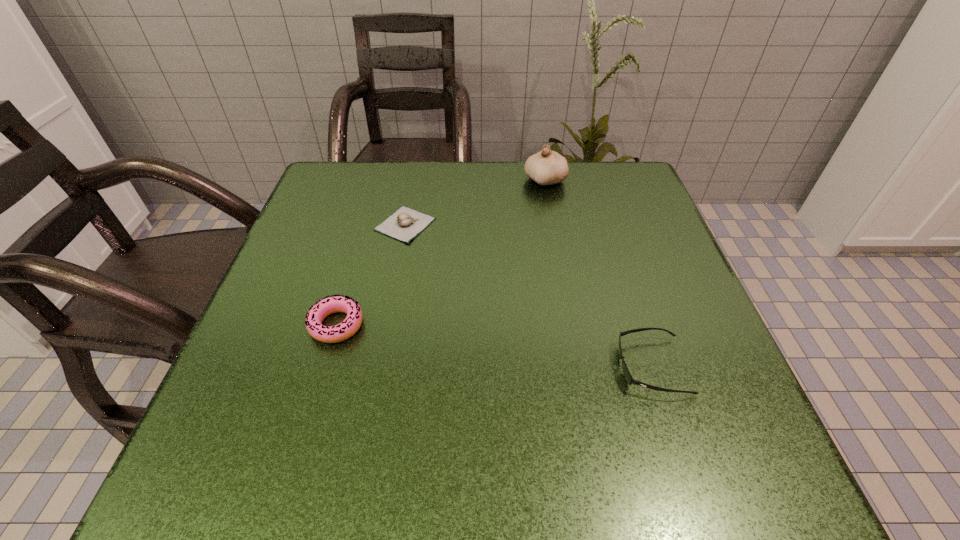
Where is `vacant space situated 0.250m on the front-facing side of the rightmost object`? The image size is (960, 540). vacant space situated 0.250m on the front-facing side of the rightmost object is located at coordinates (466, 366).

Identify the location of vacant area situated 0.120m on the right of the left garlic. This screenshot has width=960, height=540. (490, 224).

At what (x,y) coordinates should I click in order to perform the action: click on object that is positioned at the left edge. Please return your answer as a coordinate pair (x, y). The image size is (960, 540). Looking at the image, I should click on (317, 313).

Locate an element on the screen. The width and height of the screenshot is (960, 540). object that is positioned at the right edge is located at coordinates (627, 375).

Locate an element on the screen. This screenshot has width=960, height=540. free space at the far edge of the desktop is located at coordinates [x=535, y=197].

Where is `vacant space at the left edge`? The image size is (960, 540). vacant space at the left edge is located at coordinates (330, 262).

Where is `vacant region at the right edge of the desktop`? The image size is (960, 540). vacant region at the right edge of the desktop is located at coordinates (638, 267).

The image size is (960, 540). What are the coordinates of `vacant space at the far left corner` in the screenshot? It's located at (330, 174).

Image resolution: width=960 pixels, height=540 pixels. In the image, there is a desktop. What are the coordinates of `vacant region at the near left corner` in the screenshot? It's located at (215, 452).

You are a GUI agent. You are given a task and a screenshot of the screen. Output one action in this format:
    pyautogui.click(x=<x>, y=<y>)
    Task: Click on the vacant space at the far right corner
    
    Given the screenshot: What is the action you would take?
    pyautogui.click(x=593, y=172)